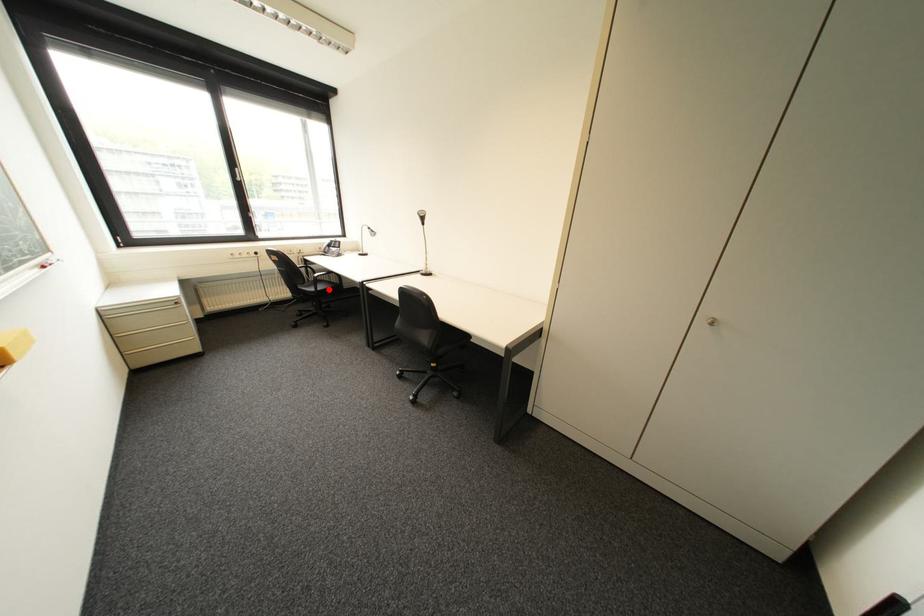
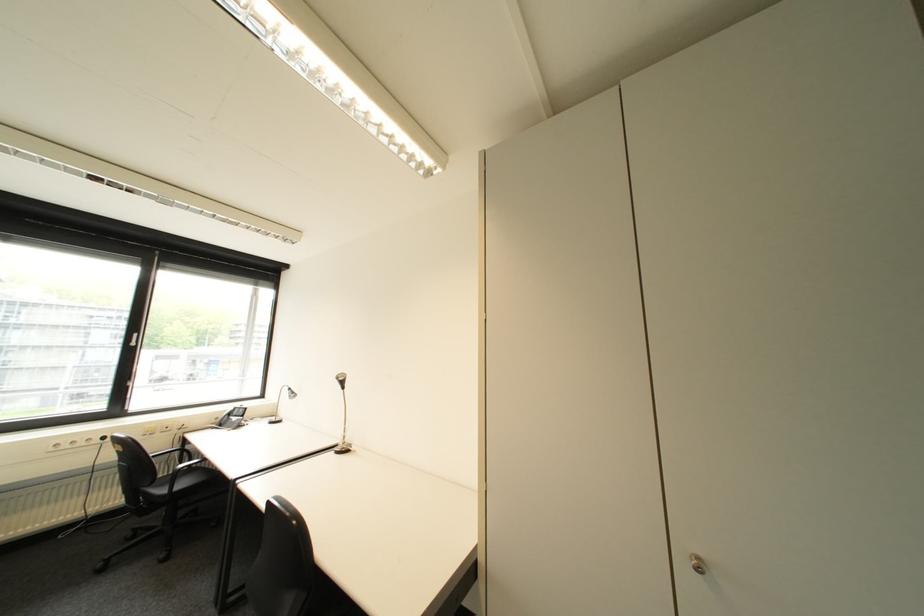
Question: I am providing you with two images of the same scene from different viewpoints. Given a red point in image1, look at the same physical point in image2. Is it:

Choices:
 (A) Closer to the viewpoint
 (B) Farther from the viewpoint

Answer: (A)